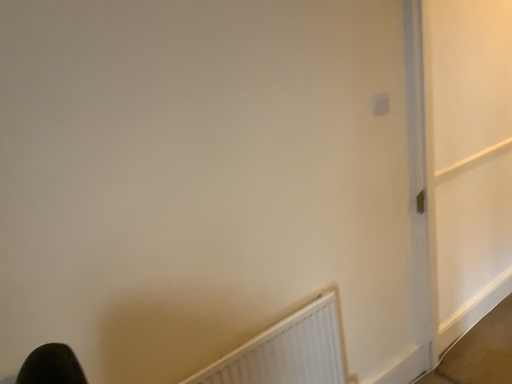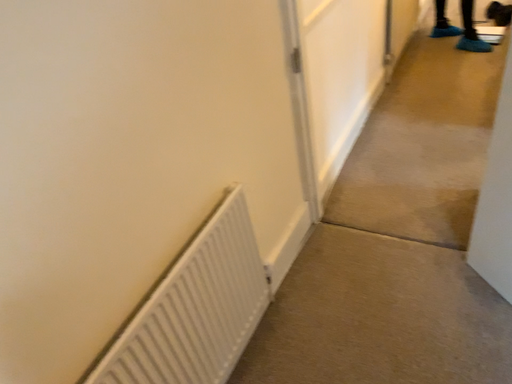
Question: Which way did the camera rotate in the video?

Choices:
 (A) rotated left
 (B) rotated right

Answer: (B)